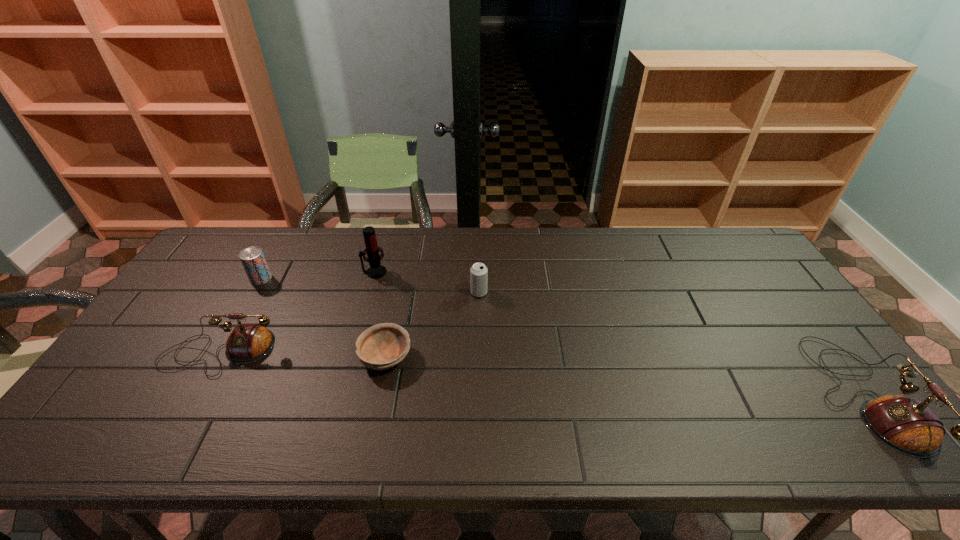
Locate an element on the screen. This screenshot has width=960, height=540. free space in the image that satisfies the following two spatial constraints: 1. on the rotary dial of the bowl; 2. on the left side of the shorter telephone is located at coordinates (218, 356).